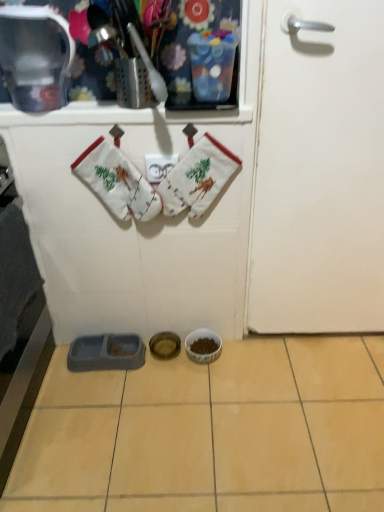
The height and width of the screenshot is (512, 384). In order to click on free location to the left of white matte door at right in this screenshot , I will do `click(248, 373)`.